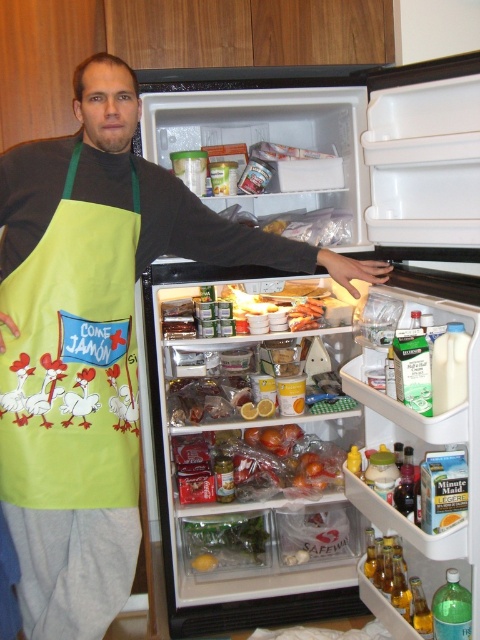
Does matte plastic refrigerator at center have a larger size compared to green fabric apron at left?

Indeed, matte plastic refrigerator at center has a larger size compared to green fabric apron at left.

Describe the element at coordinates (332, 369) in the screenshot. I see `matte plastic refrigerator at center` at that location.

Does point (345, 611) lie in front of point (17, 545)?

No, (345, 611) is behind (17, 545).

You are a GUI agent. You are given a task and a screenshot of the screen. Output one action in this format:
    pyautogui.click(x=<x>, y=<y>)
    Task: Click on the matte plastic refrigerator at center
    
    Given the screenshot: What is the action you would take?
    pyautogui.click(x=332, y=369)